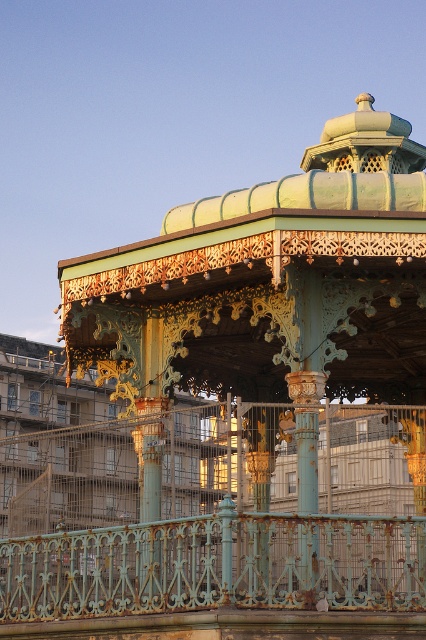
Question: Is rusty metal gazebo at center to the right of rusty metal railing at lower center from the viewer's perspective?

Choices:
 (A) yes
 (B) no

Answer: (A)

Question: Which object is closer to the camera taking this photo?

Choices:
 (A) rusty metal railing at lower center
 (B) rusty metal gazebo at center

Answer: (A)

Question: Can you confirm if rusty metal gazebo at center is smaller than rusty metal railing at lower center?

Choices:
 (A) no
 (B) yes

Answer: (A)

Question: Is rusty metal gazebo at center thinner than rusty metal railing at lower center?

Choices:
 (A) no
 (B) yes

Answer: (A)